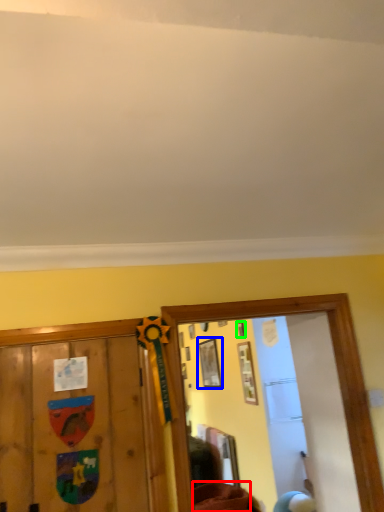
Question: Which object is positioned closest to furniture (highlighted by a red box)? Select from picture frame (highlighted by a blue box) and picture frame (highlighted by a green box).

Choices:
 (A) picture frame
 (B) picture frame

Answer: (A)